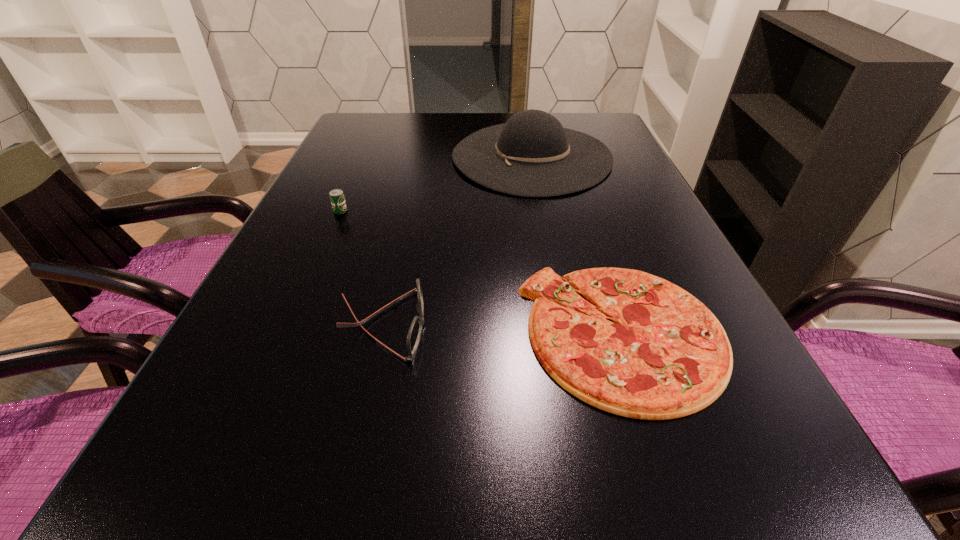
I want to click on object at the far edge, so [531, 155].

Locate an element on the screen. The height and width of the screenshot is (540, 960). object present at the left edge is located at coordinates (337, 198).

Locate an element on the screen. The image size is (960, 540). sombrero located in the right edge section of the desktop is located at coordinates (531, 155).

I want to click on pizza situated at the right edge, so click(x=666, y=356).

The width and height of the screenshot is (960, 540). Find the location of `object positioned at the far right corner`. object positioned at the far right corner is located at coordinates (531, 155).

Where is `vacant region at the left edge`? vacant region at the left edge is located at coordinates 302,337.

Find the location of a particular element. The width and height of the screenshot is (960, 540). vacant space at the right edge is located at coordinates (640, 172).

Identify the location of vacant space at the near right corner of the desktop. (779, 491).

Image resolution: width=960 pixels, height=540 pixels. Find the location of `free space between the pizza and the third object from right to left`. free space between the pizza and the third object from right to left is located at coordinates (503, 329).

Locate an element on the screen. Image resolution: width=960 pixels, height=540 pixels. vacant space that's between the spectacles and the tallest object is located at coordinates (457, 241).